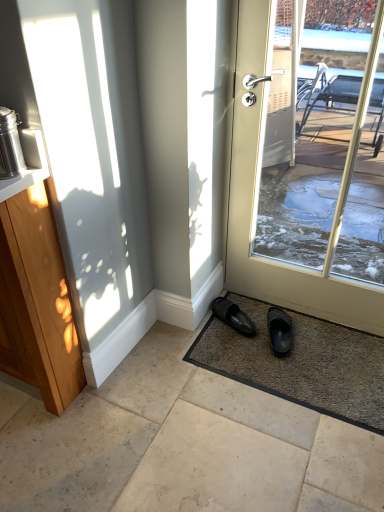
Find the location of `vacant area that lies between brown textured mat at lower center and wooden cabinet at left`. vacant area that lies between brown textured mat at lower center and wooden cabinet at left is located at coordinates (187, 395).